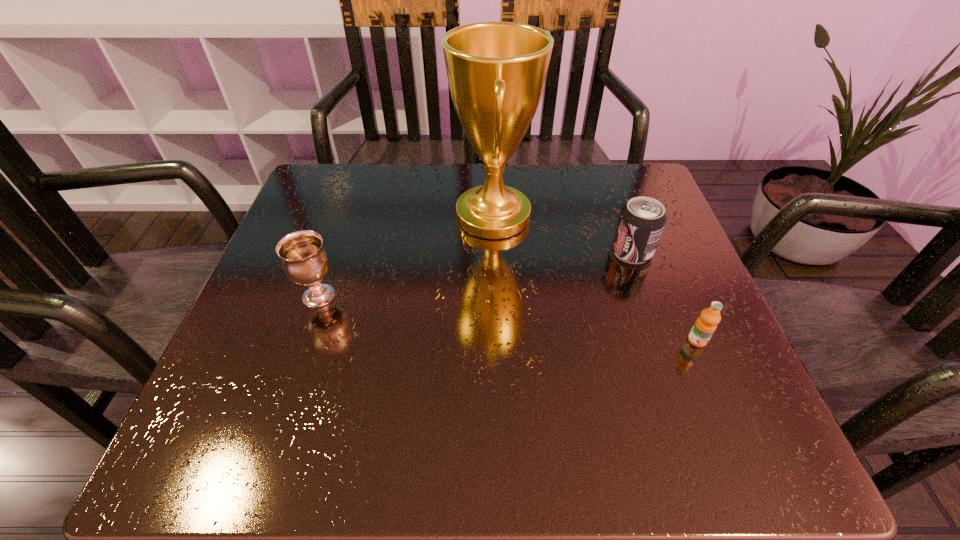
The height and width of the screenshot is (540, 960). I want to click on vacant space located 0.340m on the right of the leftmost object, so click(x=516, y=296).

This screenshot has width=960, height=540. Identify the location of free space located 0.350m on the front of the soda can. (694, 429).

The image size is (960, 540). I want to click on vacant space located 0.070m on the label of the shortest object, so click(715, 384).

At what (x,y) coordinates should I click in order to perform the action: click on object positioned at the far edge. Please return your answer as a coordinate pair (x, y). Looking at the image, I should click on (496, 71).

What are the coordinates of `object that is at the left edge` in the screenshot? It's located at (305, 261).

Identify the location of soda can that is at the right edge. The height and width of the screenshot is (540, 960). (641, 221).

What are the coordinates of `orange juice present at the right edge` in the screenshot? It's located at (706, 324).

This screenshot has width=960, height=540. In order to click on free spot at the far edge of the desktop in this screenshot , I will do `click(540, 191)`.

Locate an element on the screen. Image resolution: width=960 pixels, height=540 pixels. vacant area at the near edge of the desktop is located at coordinates coord(376,416).

Where is `vacant area at the left edge of the desktop`? This screenshot has width=960, height=540. vacant area at the left edge of the desktop is located at coordinates (347, 257).